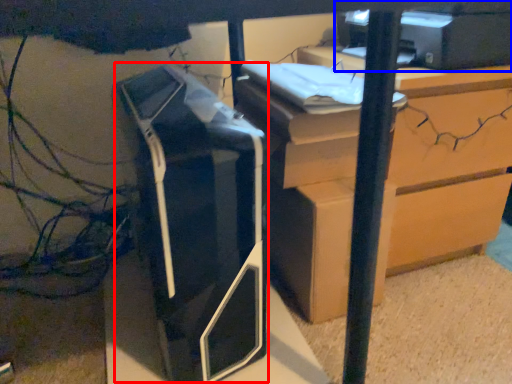
Question: Which object is closer to the camera taking this photo, printer (highlighted by a red box) or printer (highlighted by a blue box)?

Choices:
 (A) printer
 (B) printer

Answer: (A)